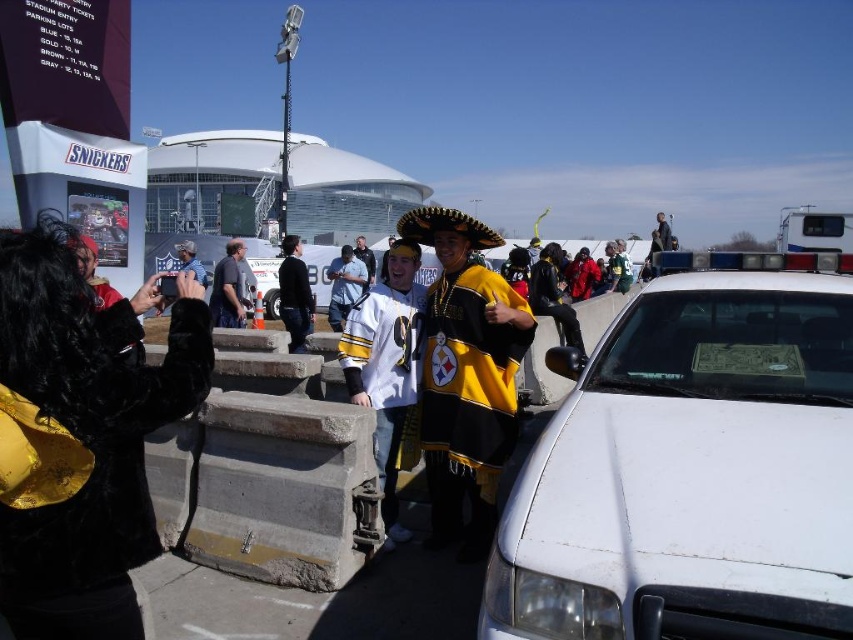
Can you confirm if white jersey at center is thinner than yellow jersey at center?

Yes.

The height and width of the screenshot is (640, 853). What are the coordinates of `white jersey at center` in the screenshot? It's located at (386, 365).

Is point (364, 372) closer to camera compared to point (354, 253)?

Yes, point (364, 372) is in front of point (354, 253).

In order to click on white jersey at center in this screenshot , I will do `click(386, 365)`.

Does white matte police car at center appear under yellow jersey at center?

Yes, white matte police car at center is below yellow jersey at center.

Is white matte police car at center further to camera compared to yellow jersey at center?

No.

Is point (556, 636) more distant than point (358, 250)?

No, it is not.

At what (x,y) coordinates should I click in order to perform the action: click on white matte police car at center. Please return your answer as a coordinate pair (x, y). Looking at the image, I should click on (692, 465).

Is black fur coat at left taller than dark blue shirt at center?

Yes.

Between black fur coat at left and dark blue shirt at center, which one has less height?

dark blue shirt at center

Looking at this image, measure the distance between black fur coat at left and camera.

black fur coat at left is 5.73 feet away from camera.

Where is `black fur coat at left`? The image size is (853, 640). black fur coat at left is located at coordinates (80, 436).